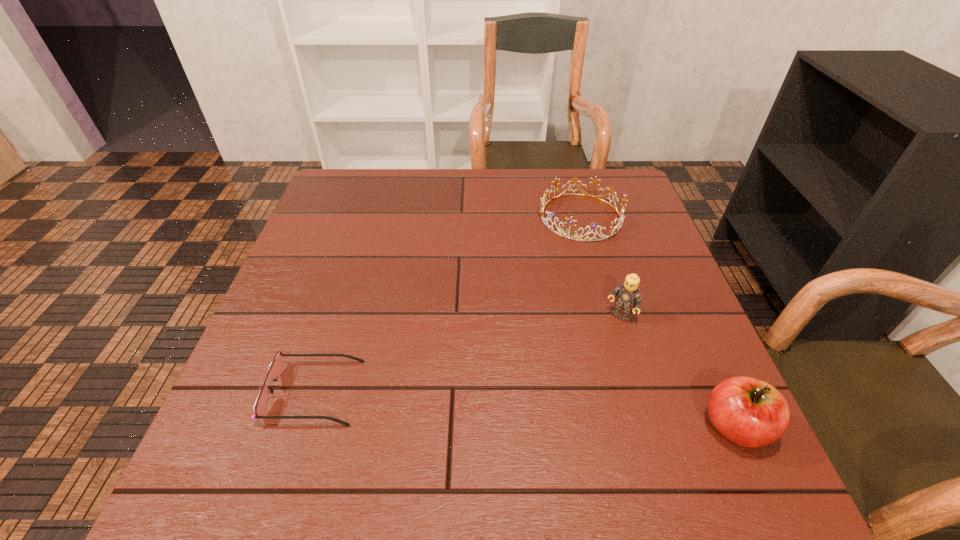
Identify the location of object that ranks as the third closest to the apple. (275, 368).

Point out which object is positioned as the nearest to the apple. Please provide its 2D coordinates. Your answer should be formatted as a tuple, i.e. [(x, y)], where the tuple contains the x and y coordinates of a point satisfying the conditions above.

[(628, 298)]

In order to click on free space that satisfies the following two spatial constraints: 1. on the front side of the apple; 2. on the left side of the farthest object in this screenshot , I will do `click(638, 426)`.

You are a GUI agent. You are given a task and a screenshot of the screen. Output one action in this format:
    pyautogui.click(x=<x>, y=<y>)
    Task: Click on the vacant space that satisfies the following two spatial constraints: 1. on the front side of the second farthest object; 2. on the right side of the third tallest object
    The image size is (960, 540).
    Given the screenshot: What is the action you would take?
    coord(609,316)